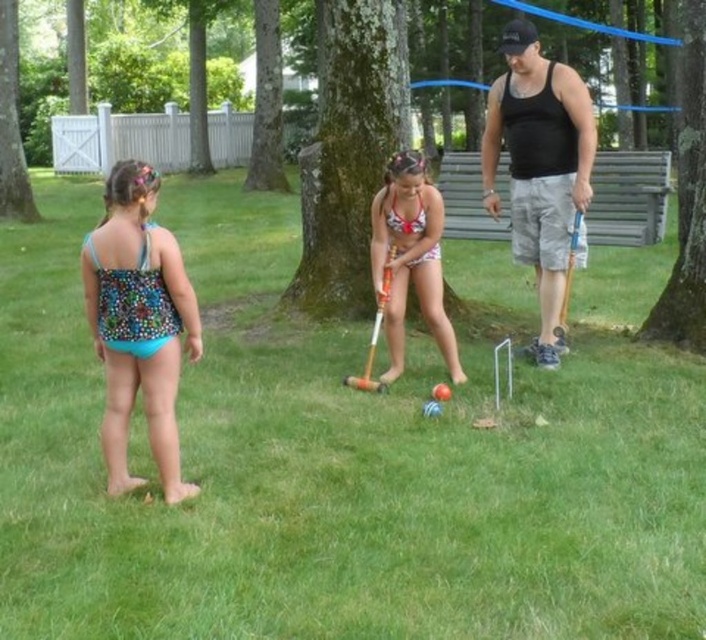
You are standing at the edge of the grassy lawn and want to place a picnic blanket exactly where the green grass at center is located. According to the coordinates provided, where should you place the blanket?

You should place the picnic blanket at the coordinates point (342, 460) where the green grass at center is located.

You are a photographer trying to capture a photo of both the black tank top at right and the white polka dot swimsuit at center. The camera can only focus on objects within a 1.2 meter width. Can you fit both into the frame without moving the camera?

The black tank top at right might be wider than white polka dot swimsuit at center, so it is uncertain if both can fit into the camera frame since the total width of both objects may exceed 1.2 meters.

In the outdoor scene, there is green grass at center and a black tank top at right. Which object is located lower in the image?

The green grass at center is located lower than the black tank top at right.